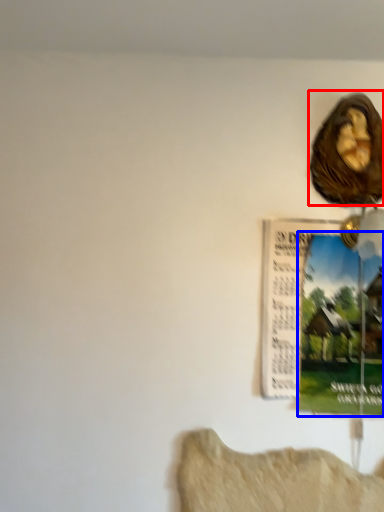
Question: Which of the following is the closest to the observer, art (highlighted by a red box) or poster page (highlighted by a blue box)?

Choices:
 (A) art
 (B) poster page

Answer: (B)